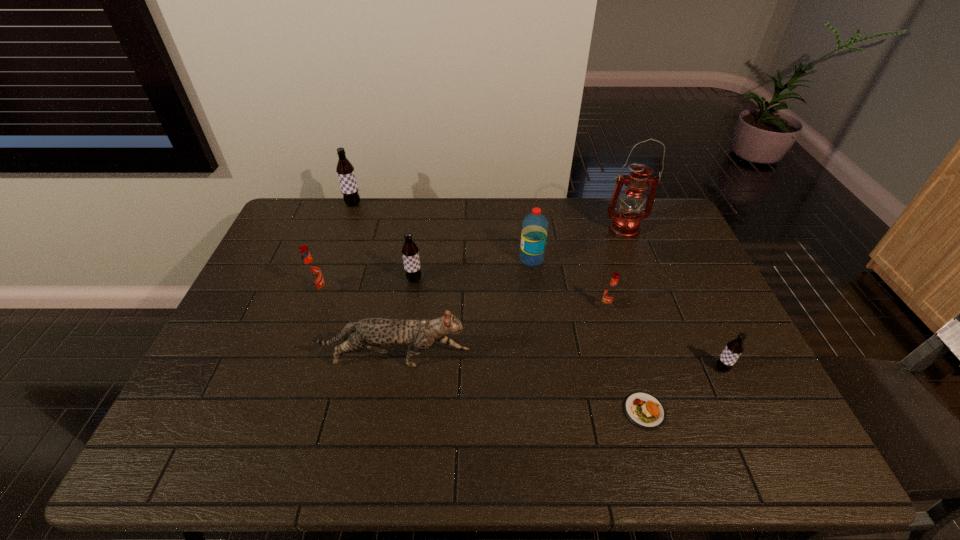
This screenshot has width=960, height=540. What are the coordinates of `object that can be found as the sixth closest to the third root beer from left to right` in the screenshot? It's located at (625, 224).

Where is `object that is the sixth closest to the red water bottle`? The width and height of the screenshot is (960, 540). object that is the sixth closest to the red water bottle is located at coordinates (734, 348).

The height and width of the screenshot is (540, 960). What are the coordinates of `root beer object that ranks as the third closest to the sixth farthest object` in the screenshot? It's located at (311, 271).

You are a GUI agent. You are given a task and a screenshot of the screen. Output one action in this format:
    pyautogui.click(x=<x>, y=<y>)
    Task: Click on the root beer that stands as the third closest to the red water bottle
    This screenshot has height=540, width=960.
    Given the screenshot: What is the action you would take?
    pyautogui.click(x=734, y=348)

Find the location of a particular element. The height and width of the screenshot is (540, 960). the second closest brown root beer to the seventh nearest object is located at coordinates (x=734, y=348).

Where is `brown root beer that is the third nearest to the bigger red root beer`? brown root beer that is the third nearest to the bigger red root beer is located at coordinates (734, 348).

I want to click on free location that satisfies the following two spatial constraints: 1. on the front label of the third farthest object; 2. on the front side of the sixth nearest object, so click(x=534, y=280).

Where is `free location that satisfies the following two spatial constraints: 1. on the back side of the rightmost object; 2. on the front label of the seventh nearest object`? The image size is (960, 540). free location that satisfies the following two spatial constraints: 1. on the back side of the rightmost object; 2. on the front label of the seventh nearest object is located at coordinates (671, 259).

Where is `blank area in the image that satisfies the following two spatial constraints: 1. on the front label of the smaller red root beer; 2. on the right side of the water bottle`? blank area in the image that satisfies the following two spatial constraints: 1. on the front label of the smaller red root beer; 2. on the right side of the water bottle is located at coordinates (538, 308).

Locate an element on the screen. The image size is (960, 540). vacant region that satisfies the following two spatial constraints: 1. on the face of the cat; 2. on the right side of the nearest object is located at coordinates (386, 411).